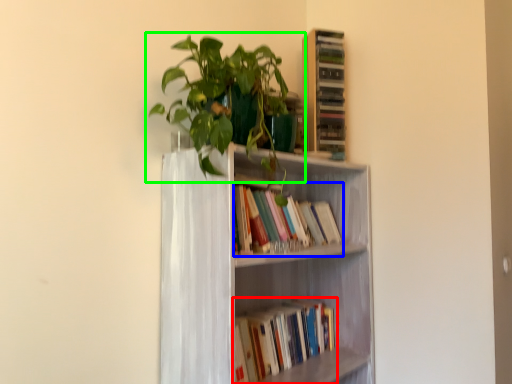
Question: Which object is positioned farthest from book (highlighted by a red box)? Select from book (highlighted by a blue box) and houseplant (highlighted by a green box).

Choices:
 (A) book
 (B) houseplant

Answer: (B)